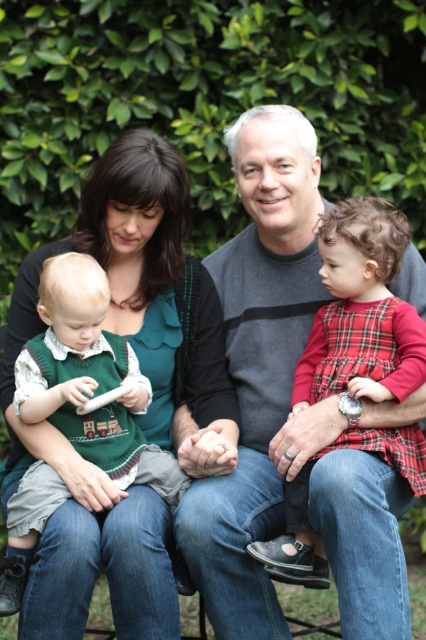
You are a tailor who needs to determine which item requires more fabric for alterations. Based on the image, which object has a greater width between the green matte dress at center and the green knitted vest at left?

The green matte dress at center has a greater width than the green knitted vest at left, so it requires more fabric for alterations.

You are a photographer trying to capture a family photo. You notice two dresses at the center of the scene. Which dress should the family member on the left wear to ensure it aligns with their current outfit? The options are the green matte dress at center and the plaid fabric dress at center.

The green matte dress at center is positioned on the left side of plaid fabric dress at center, so the family member on the left should wear the green matte dress at center to align with their current outfit.